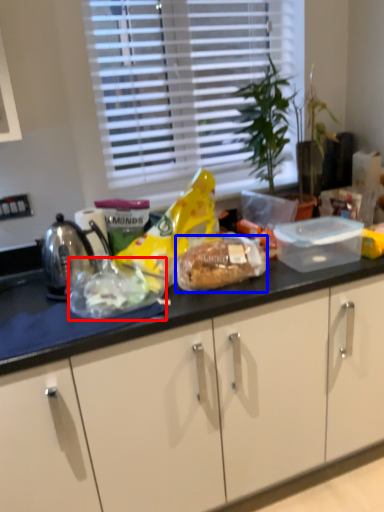
Question: Which point is further to the camera, food (highlighted by a red box) or snack (highlighted by a blue box)?

Choices:
 (A) food
 (B) snack

Answer: (B)